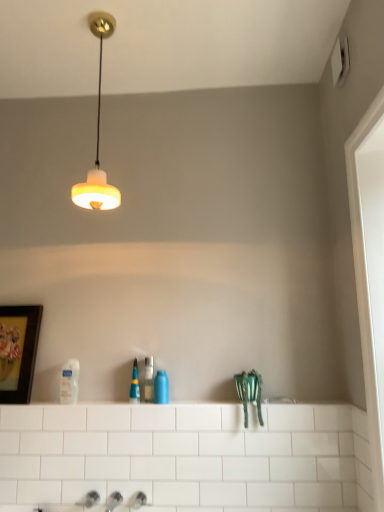
Question: Is blue glossy bottle at center, which is the third toiletry in left-to-right order, surrounding white glossy lotion at lower left, arranged as the first toiletry when viewed from the left?

Choices:
 (A) yes
 (B) no

Answer: (B)

Question: Can you see blue glossy bottle at center, which is the 1th toiletry in right-to-left order, touching white glossy lotion at lower left, which is counted as the 3th toiletry, starting from the right?

Choices:
 (A) yes
 (B) no

Answer: (B)

Question: From a real-world perspective, is blue glossy bottle at center, which is the third toiletry in left-to-right order, located beneath white glossy lotion at lower left, which is counted as the 3th toiletry, starting from the right?

Choices:
 (A) no
 (B) yes

Answer: (B)

Question: Is blue glossy bottle at center, which is the third toiletry in left-to-right order, closer to camera compared to white glossy lotion at lower left, arranged as the first toiletry when viewed from the left?

Choices:
 (A) no
 (B) yes

Answer: (B)

Question: Is blue glossy bottle at center, which is the third toiletry in left-to-right order, wider than white glossy lotion at lower left, arranged as the first toiletry when viewed from the left?

Choices:
 (A) no
 (B) yes

Answer: (B)

Question: Would you say blue glossy bottle at center, which is the 1th toiletry in right-to-left order, is outside white glossy lotion at lower left, arranged as the first toiletry when viewed from the left?

Choices:
 (A) yes
 (B) no

Answer: (A)

Question: Can we say translucent plastic bottle at center, the second toiletry from the left, lies outside white glossy ledge at center?

Choices:
 (A) yes
 (B) no

Answer: (A)

Question: Is white glossy ledge at center completely or partially inside translucent plastic bottle at center, marked as the 2th toiletry in a right-to-left arrangement?

Choices:
 (A) no
 (B) yes

Answer: (A)

Question: Is translucent plastic bottle at center, marked as the 2th toiletry in a right-to-left arrangement, thinner than white glossy ledge at center?

Choices:
 (A) no
 (B) yes

Answer: (B)

Question: Is translucent plastic bottle at center, the second toiletry from the left, facing away from white glossy ledge at center?

Choices:
 (A) no
 (B) yes

Answer: (A)

Question: Can you confirm if translucent plastic bottle at center, the second toiletry from the left, is taller than white glossy ledge at center?

Choices:
 (A) yes
 (B) no

Answer: (A)

Question: Is translucent plastic bottle at center, the second toiletry from the left, wider than white glossy ledge at center?

Choices:
 (A) yes
 (B) no

Answer: (B)

Question: Does wooden framed artwork at left come behind matte white lampshade at upper center?

Choices:
 (A) no
 (B) yes

Answer: (B)